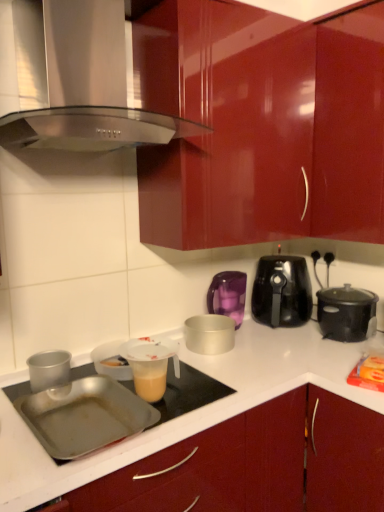
Describe the element at coordinates (282, 291) in the screenshot. This screenshot has width=384, height=512. I see `black plastic air fryer at center right, which is the 2th kitchen appliance from right to left` at that location.

What is the approximate height of black plastic air fryer at center right, which is the 2th kitchen appliance from right to left?

black plastic air fryer at center right, which is the 2th kitchen appliance from right to left, is 30.95 centimeters tall.

In order to face black plastic slow cooker at right, which is the 5th kitchen appliance in left-to-right order, should I rotate leftwards or rightwards?

It's best to rotate right around 19.717 degrees.

Locate an element on the screen. The width and height of the screenshot is (384, 512). orange plastic bag at lower right is located at coordinates (371, 368).

At what (x,y) coordinates should I click in order to perform the action: click on silver metallic pot at center, acting as the second kitchen appliance starting from the left. Please return your answer as a coordinate pair (x, y). The image size is (384, 512). Looking at the image, I should click on (209, 334).

Where is `black plastic air fryer at center right, which is the 2th kitchen appliance from right to left`? This screenshot has height=512, width=384. black plastic air fryer at center right, which is the 2th kitchen appliance from right to left is located at coordinates (282, 291).

Is metallic silver pot at left, acting as the 5th kitchen appliance starting from the right, completely or partially outside of translucent plastic measuring cup at center?

Yes, metallic silver pot at left, acting as the 5th kitchen appliance starting from the right, is outside of translucent plastic measuring cup at center.

From the image's perspective, is metallic silver pot at left, acting as the 5th kitchen appliance starting from the right, positioned above or below translucent plastic measuring cup at center?

metallic silver pot at left, acting as the 5th kitchen appliance starting from the right, is below translucent plastic measuring cup at center.

Which object is thinner, metallic silver pot at left, acting as the 5th kitchen appliance starting from the right, or translucent plastic measuring cup at center?

metallic silver pot at left, acting as the 5th kitchen appliance starting from the right.

Which is behind, point (239, 318) or point (230, 394)?

The point (239, 318) is more distant.

From a real-world perspective, does matte silver container at center, which ranks as the third kitchen appliance in right-to-left order, stand above metallic silver pan at lower left?

Yes, from a real-world perspective, matte silver container at center, which ranks as the third kitchen appliance in right-to-left order, is on top of metallic silver pan at lower left.

Are matte silver container at center, which is counted as the third kitchen appliance, starting from the left, and metallic silver pan at lower left located far from each other?

No, matte silver container at center, which is counted as the third kitchen appliance, starting from the left, is not far from metallic silver pan at lower left.

Which object is closer to the camera, matte silver container at center, which ranks as the third kitchen appliance in right-to-left order, or metallic silver pan at lower left?

metallic silver pan at lower left is closer to the camera.

Looking at this image, from the image's perspective, does translucent plastic measuring cup at center appear lower than silver metallic pot at center, acting as the second kitchen appliance starting from the left?

Yes, from the image's perspective, translucent plastic measuring cup at center is below silver metallic pot at center, acting as the second kitchen appliance starting from the left.

Is translucent plastic measuring cup at center further to the viewer compared to silver metallic pot at center, the 4th kitchen appliance positioned from the right?

No, the depth of translucent plastic measuring cup at center is less than that of silver metallic pot at center, the 4th kitchen appliance positioned from the right.

Would you say translucent plastic measuring cup at center is outside silver metallic pot at center, acting as the second kitchen appliance starting from the left?

translucent plastic measuring cup at center lies outside silver metallic pot at center, acting as the second kitchen appliance starting from the left,'s area.

Is translucent plastic measuring cup at center aimed at silver metallic pot at center, acting as the second kitchen appliance starting from the left?

No, translucent plastic measuring cup at center is not oriented towards silver metallic pot at center, acting as the second kitchen appliance starting from the left.

Which object is more forward, metallic silver pan at lower left or matte silver container at center, which is counted as the third kitchen appliance, starting from the left?

metallic silver pan at lower left is more forward.

Is point (187, 398) positioned in front of point (227, 303)?

Yes, it is in front of point (227, 303).

How many degrees apart are the facing directions of metallic silver pan at lower left and matte silver container at center, which ranks as the third kitchen appliance in right-to-left order?

The angular difference between metallic silver pan at lower left and matte silver container at center, which ranks as the third kitchen appliance in right-to-left order, is 5.23 degrees.

Can you confirm if silver metallic pot at center, acting as the second kitchen appliance starting from the left, is shorter than metallic silver pot at left, acting as the 5th kitchen appliance starting from the right?

No.

Is silver metallic pot at center, acting as the second kitchen appliance starting from the left, directly adjacent to metallic silver pot at left, acting as the 5th kitchen appliance starting from the right?

No, silver metallic pot at center, acting as the second kitchen appliance starting from the left, is not in contact with metallic silver pot at left, acting as the 5th kitchen appliance starting from the right.

From a real-world perspective, which object rests below the other?

metallic silver pot at left, which is the 1th kitchen appliance from left to right, from a real-world perspective.

Between silver metallic pot at center, the 4th kitchen appliance positioned from the right, and metallic silver pot at left, acting as the 5th kitchen appliance starting from the right, which one has larger size?

With larger size is silver metallic pot at center, the 4th kitchen appliance positioned from the right.

Is matte silver container at center, which ranks as the third kitchen appliance in right-to-left order, positioned behind metallic silver pot at left, which is the 1th kitchen appliance from left to right?

Yes, matte silver container at center, which ranks as the third kitchen appliance in right-to-left order, is behind metallic silver pot at left, which is the 1th kitchen appliance from left to right.

From a real-world perspective, is matte silver container at center, which ranks as the third kitchen appliance in right-to-left order, physically above metallic silver pot at left, which is the 1th kitchen appliance from left to right?

Correct, in the physical world, matte silver container at center, which ranks as the third kitchen appliance in right-to-left order, is higher than metallic silver pot at left, which is the 1th kitchen appliance from left to right.

Can you confirm if matte silver container at center, which is counted as the third kitchen appliance, starting from the left, is taller than metallic silver pot at left, which is the 1th kitchen appliance from left to right?

Yes, matte silver container at center, which is counted as the third kitchen appliance, starting from the left, is taller than metallic silver pot at left, which is the 1th kitchen appliance from left to right.

Between matte silver container at center, which is counted as the third kitchen appliance, starting from the left, and metallic silver pot at left, which is the 1th kitchen appliance from left to right, which one has larger size?

With larger size is matte silver container at center, which is counted as the third kitchen appliance, starting from the left.

Where is `gas stove that is under the translucent plastic measuring cup at center (from a real-world perspective)`? This screenshot has height=512, width=384. gas stove that is under the translucent plastic measuring cup at center (from a real-world perspective) is located at coordinates (189, 392).

What's the angular difference between translucent plastic measuring cup at center and metallic silver pan at lower left's facing directions?

The angle between the facing direction of translucent plastic measuring cup at center and the facing direction of metallic silver pan at lower left is 4.95 degrees.

In terms of width, does translucent plastic measuring cup at center look wider or thinner when compared to metallic silver pan at lower left?

Considering their sizes, translucent plastic measuring cup at center looks slimmer than metallic silver pan at lower left.

In the scene shown: Which object is further away from the camera, translucent plastic measuring cup at center or metallic silver pan at lower left?

translucent plastic measuring cup at center is further away from the camera.

Locate an element on the screen. Image resolution: width=384 pixels, height=512 pixels. appliance in front of the metallic silver pot at left, which is the 1th kitchen appliance from left to right is located at coordinates (150, 365).

You are a GUI agent. You are given a task and a screenshot of the screen. Output one action in this format:
    pyautogui.click(x=<x>, y=<y>)
    Task: Click on the gas stove located below the matte silver container at center, which ranks as the third kitchen appliance in right-to-left order (from the image's perspective)
    
    Given the screenshot: What is the action you would take?
    pyautogui.click(x=189, y=392)

Looking at the image, which one is located closer to matte silver container at center, which ranks as the third kitchen appliance in right-to-left order, orange plastic bag at lower right or black plastic slow cooker at right, which is the 5th kitchen appliance in left-to-right order?

Based on the image, black plastic slow cooker at right, which is the 5th kitchen appliance in left-to-right order, appears to be nearer to matte silver container at center, which ranks as the third kitchen appliance in right-to-left order.

Based on their spatial positions, is orange plastic bag at lower right or metallic silver pot at left, acting as the 5th kitchen appliance starting from the right, further from stainless steel range hood at upper center?

orange plastic bag at lower right is further to stainless steel range hood at upper center.

Looking at the image, which one is located further to metallic silver pan at lower left, black plastic air fryer at center right, which is the 2th kitchen appliance from right to left, or matte silver container at center, which is counted as the third kitchen appliance, starting from the left?

The object further to metallic silver pan at lower left is black plastic air fryer at center right, which is the 2th kitchen appliance from right to left.

Which object lies nearer to the anchor point orange plastic bag at lower right, stainless steel range hood at upper center or silver metallic pot at center, the 4th kitchen appliance positioned from the right?

The object closer to orange plastic bag at lower right is silver metallic pot at center, the 4th kitchen appliance positioned from the right.

Looking at the image, which one is located further to orange plastic bag at lower right, black plastic air fryer at center right, which is the 2th kitchen appliance from right to left, or translucent plastic measuring cup at center?

translucent plastic measuring cup at center is further to orange plastic bag at lower right.

From the image, which object appears to be nearer to matte silver container at center, which is counted as the third kitchen appliance, starting from the left, black plastic air fryer at center right, which is the 2th kitchen appliance from right to left, or orange plastic bag at lower right?

black plastic air fryer at center right, which is the 2th kitchen appliance from right to left, lies closer to matte silver container at center, which is counted as the third kitchen appliance, starting from the left, than the other object.

Looking at the image, which one is located closer to metallic silver pan at lower left, translucent plastic measuring cup at center or orange plastic bag at lower right?

Among the two, translucent plastic measuring cup at center is located nearer to metallic silver pan at lower left.

Based on the photo, based on their spatial positions, is stainless steel range hood at upper center or metallic silver pan at lower left further from metallic silver pot at left, which is the 1th kitchen appliance from left to right?

stainless steel range hood at upper center is positioned further to the anchor metallic silver pot at left, which is the 1th kitchen appliance from left to right.

Image resolution: width=384 pixels, height=512 pixels. I want to click on kitchen appliance located between silver metallic pot at center, acting as the second kitchen appliance starting from the left, and black plastic air fryer at center right, which is the 2th kitchen appliance from right to left, in the left-right direction, so click(x=228, y=295).

Locate an element on the screen. The height and width of the screenshot is (512, 384). food that lies between stainless steel range hood at upper center and translucent plastic measuring cup at center from top to bottom is located at coordinates (371, 368).

Image resolution: width=384 pixels, height=512 pixels. What are the coordinates of `appliance between metallic silver pan at lower left and orange plastic bag at lower right` in the screenshot? It's located at (150, 365).

Find the location of a particular element. Image resolution: width=384 pixels, height=512 pixels. appliance between stainless steel range hood at upper center and metallic silver pot at left, which is the 1th kitchen appliance from left to right, in the up-down direction is located at coordinates (150, 365).